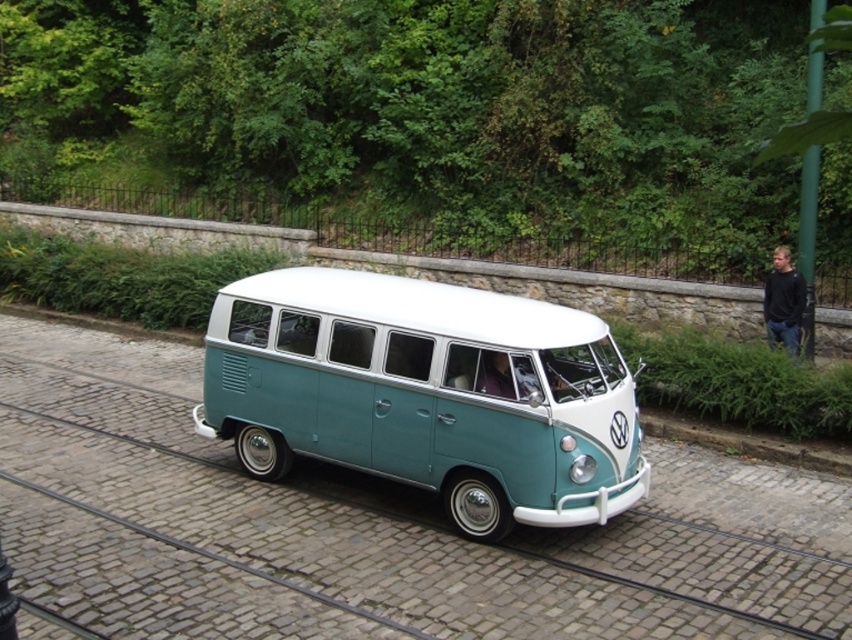
You are a delivery person trying to park your delivery van next to the teal matte van at center and the black cotton shirt at right. Since you need to know which one takes up more space, which object is wider?

The teal matte van at center is wider than the black cotton shirt at right.

You are standing at the point marked by the coordinates point (407,531) in the image. What is the closest object to you in the scene?

The point (407,531) indicates metal train track at center, so the closest object to you is the metal train track at center.